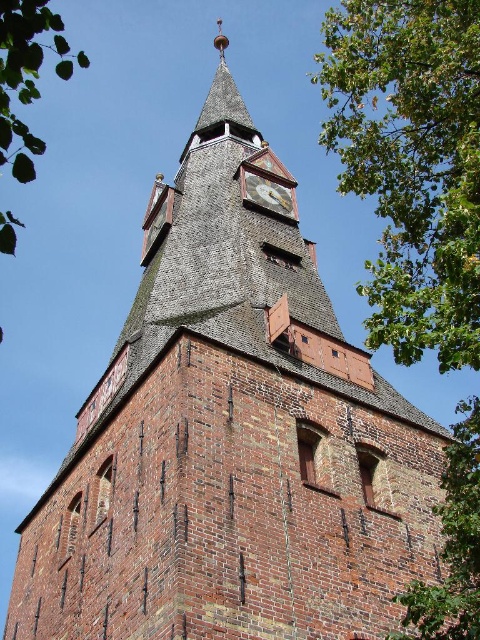
You are an architect examining the tower and notice the green leafy tree at upper right and the gold metallic clock at center. Which object is positioned nearer to your viewpoint?

The green leafy tree at upper right is closer to the viewer than the gold metallic clock at center.